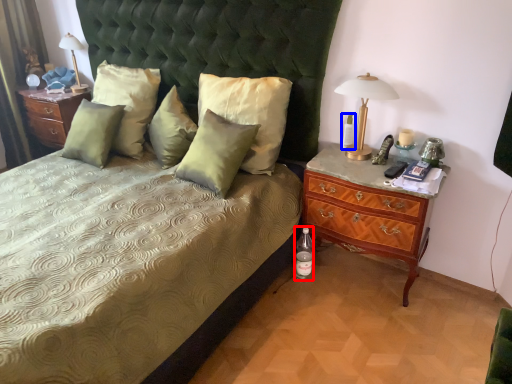
Question: Among these objects, which one is farthest to the camera, bottle (highlighted by a red box) or bottle (highlighted by a blue box)?

Choices:
 (A) bottle
 (B) bottle

Answer: (A)